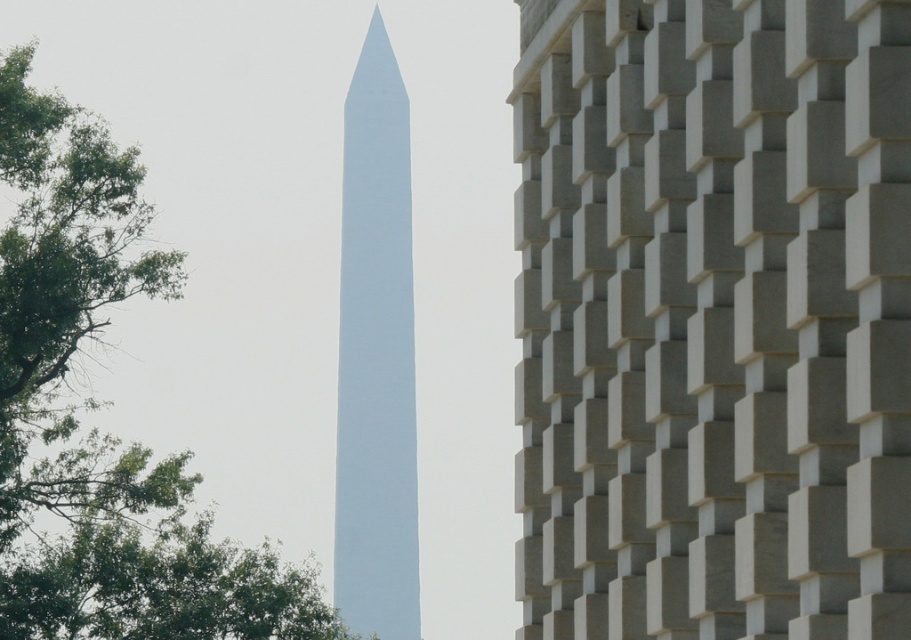
You are standing in the park and see the gray concrete blocks at center and the white smooth tower at center. Which object is located to the right side from your perspective?

The gray concrete blocks at center is to the right of the white smooth tower at center, so the gray concrete blocks at center is located to the right side from your perspective.

You are standing in front of the Washington Monument and notice a point marked at coordinates [96,428]. Which object does this point belong to?

The point at coordinates [96,428] is located on the green leafy tree at left.